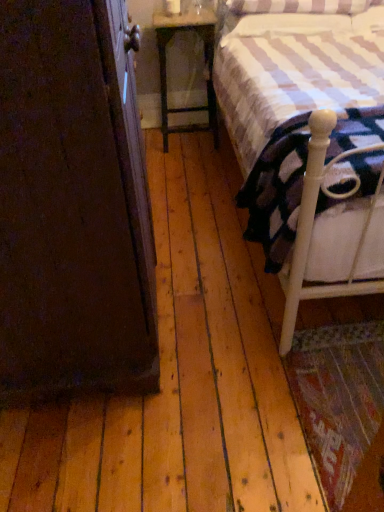
Locate an element on the screen. The image size is (384, 512). vacant space underneath wooden nightstand at center (from a real-world perspective) is located at coordinates (195, 136).